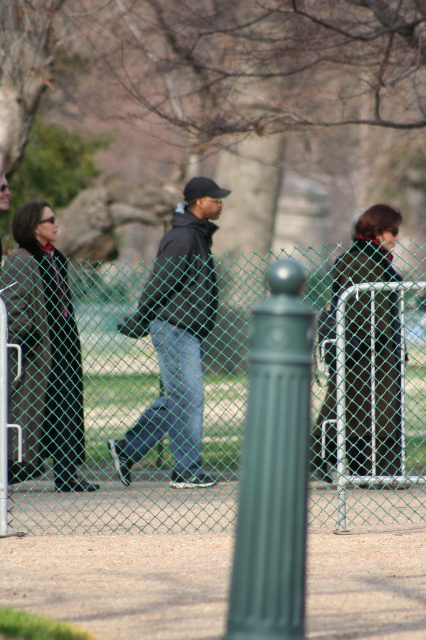
You are a fashion designer analyzing the clothing items in the image. You notice the dark blue jeans at center and the dark brown leather jacket at center. Which clothing item appears larger in the image?

The dark blue jeans at center appears larger than the dark brown leather jacket at center in the image.

You are standing at the park and see a woman wearing a dark brown leather coat at left and a man wearing dark blue jeans at center. Which piece of clothing is positioned lower in the image?

The dark brown leather coat at left is located below dark blue jeans at center, so the dark brown leather coat at left is positioned lower in the image.

You are a fashion designer observing people in the park. You notice a dark brown leather coat at left and a dark blue jeans at center. Which clothing item appears narrower?

The dark brown leather coat at left is narrower than the dark blue jeans at center.